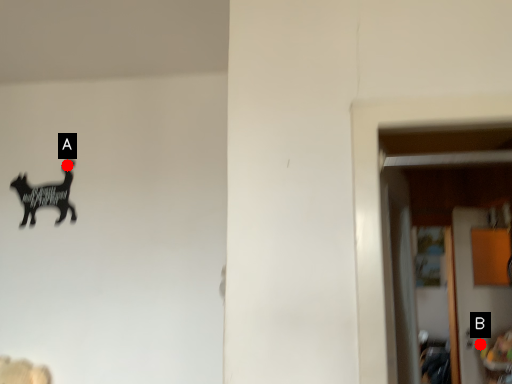
Question: Two points are circled on the image, labeled by A and B beside each circle. Among these points, which one is nearest to the camera?

Choices:
 (A) A is closer
 (B) B is closer

Answer: (A)